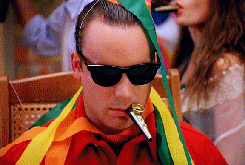
The width and height of the screenshot is (245, 165). I want to click on bottle of jack daniels, so click(30, 64).